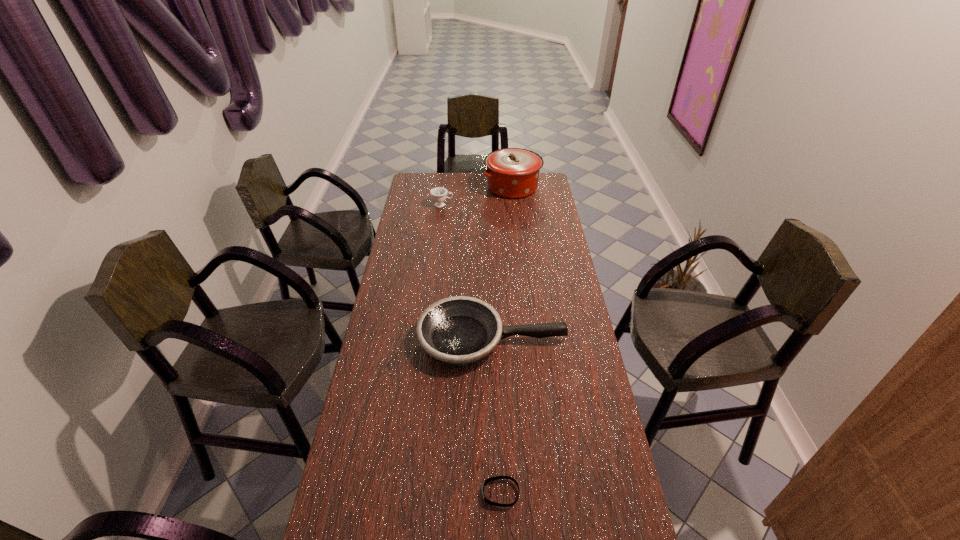
Locate an element on the screen. vacant region located 0.140m on the display of the wristband is located at coordinates (428, 493).

Where is `object at the far edge`? The image size is (960, 540). object at the far edge is located at coordinates (513, 173).

The height and width of the screenshot is (540, 960). I want to click on object that is at the left edge, so click(x=438, y=194).

Identify the location of casserole present at the right edge. (513, 173).

Locate an element on the screen. This screenshot has width=960, height=540. frying pan that is at the right edge is located at coordinates click(460, 330).

Where is `object positioned at the far right corner`? object positioned at the far right corner is located at coordinates (513, 173).

The image size is (960, 540). In order to click on vacant space at the far edge in this screenshot , I will do `click(478, 188)`.

This screenshot has height=540, width=960. I want to click on vacant area at the left edge of the desktop, so click(x=403, y=239).

Find the location of `free space at the right edge of the desktop`. free space at the right edge of the desktop is located at coordinates (537, 296).

The height and width of the screenshot is (540, 960). In order to click on free spot between the third farthest object and the wristband in this screenshot , I will do (x=496, y=416).